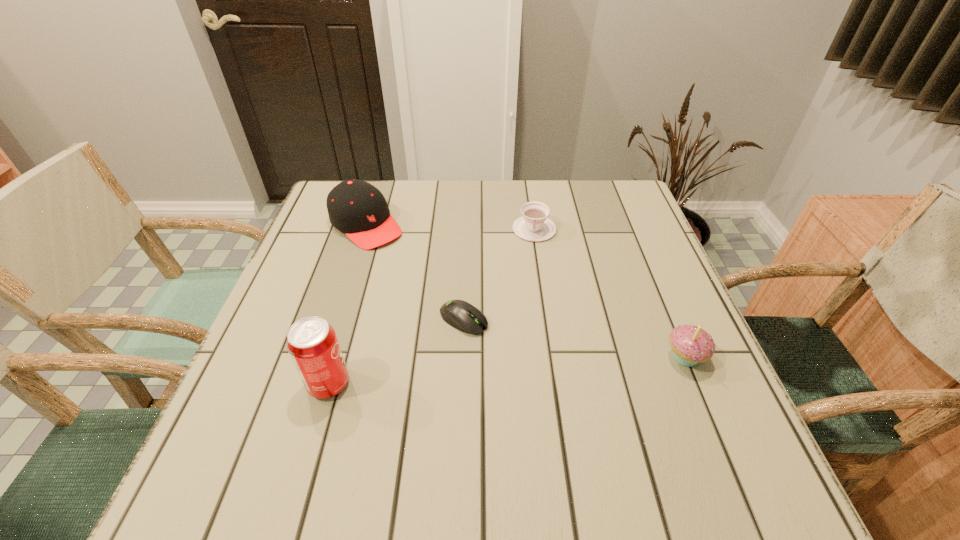
I want to click on free spot on the desktop that is between the tallest object and the cupcake and is positioned on the handle side of the teacup, so click(x=525, y=369).

Identify the location of vacant space on the desktop that is between the tallest object and the cupcake and is positioned on the front-facing side of the cap. (522, 369).

The width and height of the screenshot is (960, 540). Identify the location of vacant space on the desktop that is between the soda and the rightmost object and is positioned on the wheel side of the third nearest object. (543, 368).